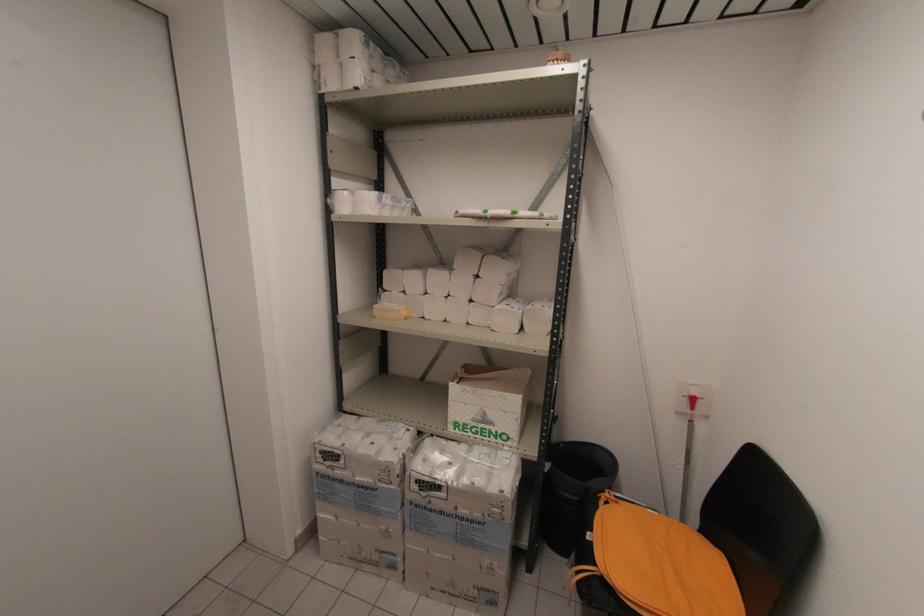
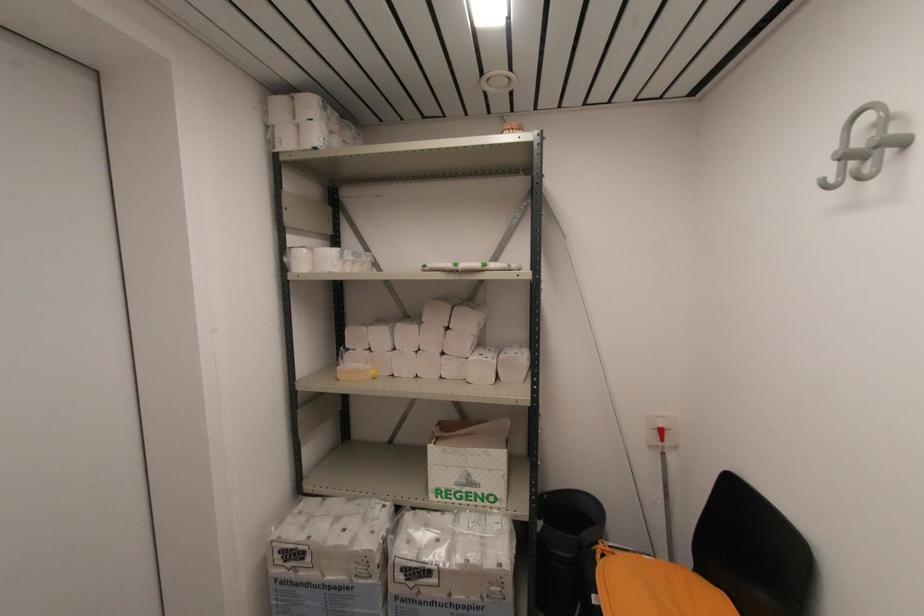
The point at (322, 453) is marked in the first image. Where is the corresponding point in the second image?

(281, 553)